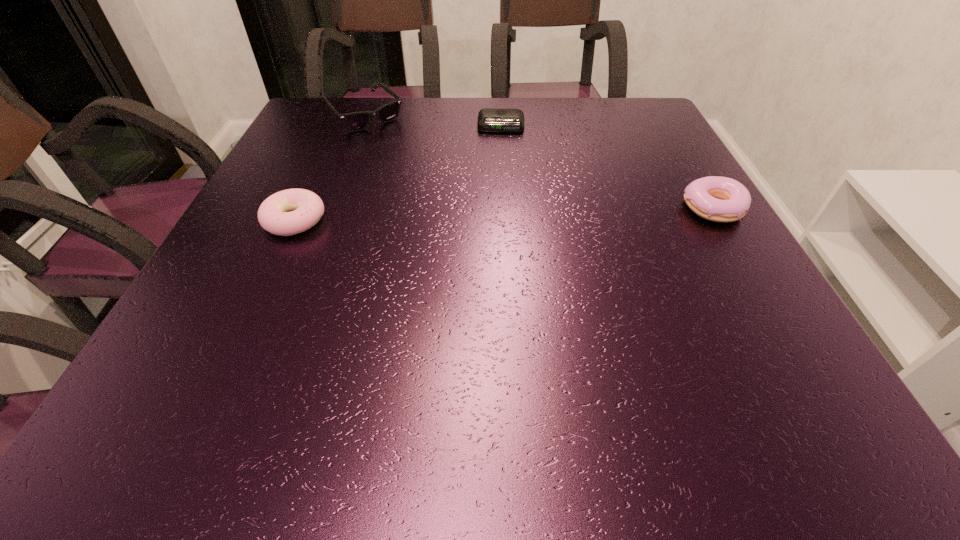
Where is `vacant space at the far edge of the desktop`? This screenshot has height=540, width=960. vacant space at the far edge of the desktop is located at coordinates (492, 98).

This screenshot has height=540, width=960. I want to click on vacant space at the near edge, so click(x=342, y=364).

Where is `vacant region at the left edge of the desktop`? vacant region at the left edge of the desktop is located at coordinates (300, 274).

This screenshot has width=960, height=540. In the image, there is a desktop. Identify the location of free space at the right edge. (671, 265).

Where is `free space at the far left corner`? The image size is (960, 540). free space at the far left corner is located at coordinates (339, 127).

At what (x,y) coordinates should I click in order to perform the action: click on free region at the near left corner of the desktop. Please return your answer as a coordinate pair (x, y). This screenshot has height=540, width=960. Looking at the image, I should click on (191, 353).

Where is `blank area at the far right corner`? blank area at the far right corner is located at coordinates (605, 99).

Where is `free space at the near right corner of the desktop`? Image resolution: width=960 pixels, height=540 pixels. free space at the near right corner of the desktop is located at coordinates (718, 344).

Find the location of `vacant point located between the left doughnut and the rightmost object`. vacant point located between the left doughnut and the rightmost object is located at coordinates click(x=504, y=214).

Locate an element on the screen. free space between the sunglasses and the right doughnut is located at coordinates (539, 162).